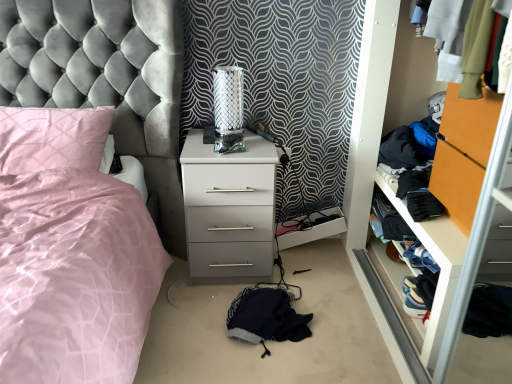
What are the coordinates of `white glossy chest of drawers at center` in the screenshot? It's located at (229, 210).

At what (x,y) coordinates should I click in order to perform the action: click on pink satin pillow at left. Please return your answer as a coordinate pair (x, y). The height and width of the screenshot is (384, 512). Looking at the image, I should click on (52, 138).

This screenshot has height=384, width=512. I want to click on satin pink bed at left, so click(106, 78).

Image resolution: width=512 pixels, height=384 pixels. What do you see at coordinates (106, 78) in the screenshot?
I see `satin pink bed at left` at bounding box center [106, 78].

This screenshot has width=512, height=384. In order to click on white glossy chest of drawers at center in this screenshot , I will do `click(229, 210)`.

From the image's perspective, does black fleece gloves at right, the 3th clothing ordered from the bottom, appear lower than denim fabric clothes at right?

No, from the image's perspective, black fleece gloves at right, the 3th clothing ordered from the bottom, is not beneath denim fabric clothes at right.

Is black fleece gloves at right, the 2th clothing positioned from the left, bigger or smaller than denim fabric clothes at right?

In the image, black fleece gloves at right, the 2th clothing positioned from the left, appears to be smaller than denim fabric clothes at right.

Is there a large distance between black fleece gloves at right, which is the first clothing from top to bottom, and denim fabric clothes at right?

Actually, black fleece gloves at right, which is the first clothing from top to bottom, and denim fabric clothes at right are a little close together.

Could denim fabric clothes at right be considered to be inside pink satin pillow at left?

No, denim fabric clothes at right is not surrounded by pink satin pillow at left.

Would you consider pink satin pillow at left to be distant from denim fabric clothes at right?

Yes.

Could you tell me if pink satin pillow at left is turned towards denim fabric clothes at right?

No, pink satin pillow at left is not turned towards denim fabric clothes at right.

Is pink satin pillow at left at the left side of denim fabric clothes at right?

Correct, you'll find pink satin pillow at left to the left of denim fabric clothes at right.

Is metallic mesh table lamp at center closer to the viewer compared to satin pink bed at left?

No, metallic mesh table lamp at center is further to the viewer.

How much distance is there between metallic mesh table lamp at center and satin pink bed at left?

metallic mesh table lamp at center and satin pink bed at left are 40.62 centimeters apart.

Which is in front, point (234, 73) or point (119, 146)?

The point (234, 73) is in front.

Could you tell me if metallic mesh table lamp at center is facing satin pink bed at left?

No, metallic mesh table lamp at center is not turned towards satin pink bed at left.

How distant is orange wood file cabinet at right from fuzzy dark blue blanket at lower center, the third clothing from the right?

They are 31.66 inches apart.

In the scene shown: Choose the correct answer: Is orange wood file cabinet at right inside fuzzy dark blue blanket at lower center, the first clothing when ordered from left to right, or outside it?

orange wood file cabinet at right lies outside fuzzy dark blue blanket at lower center, the first clothing when ordered from left to right.

From the image's perspective, who appears lower, orange wood file cabinet at right or fuzzy dark blue blanket at lower center, the third clothing from the right?

fuzzy dark blue blanket at lower center, the third clothing from the right, is shown below in the image.

Is orange wood file cabinet at right turned away from fuzzy dark blue blanket at lower center, the first clothing when ordered from left to right?

No, fuzzy dark blue blanket at lower center, the first clothing when ordered from left to right, is not at the back of orange wood file cabinet at right.

From the image's perspective, is orange wood file cabinet at right located above or below metallic mesh table lamp at center?

orange wood file cabinet at right is below metallic mesh table lamp at center.

Considering the relative sizes of orange wood file cabinet at right and metallic mesh table lamp at center in the image provided, is orange wood file cabinet at right taller than metallic mesh table lamp at center?

Indeed, orange wood file cabinet at right has a greater height compared to metallic mesh table lamp at center.

Is orange wood file cabinet at right at the right side of metallic mesh table lamp at center?

Indeed, orange wood file cabinet at right is positioned on the right side of metallic mesh table lamp at center.

Is orange wood file cabinet at right positioned in front of metallic mesh table lamp at center?

Yes, it is.

Is fuzzy dark blue blanket at lower center, the first clothing when ordered from left to right, turned away from denim fabric clothes at right?

That's not correct — fuzzy dark blue blanket at lower center, the first clothing when ordered from left to right, is not looking away from denim fabric clothes at right.

Which is more to the left, fuzzy dark blue blanket at lower center, the third clothing from the right, or denim fabric clothes at right?

Positioned to the left is fuzzy dark blue blanket at lower center, the third clothing from the right.

From a real-world perspective, is fuzzy dark blue blanket at lower center, the first clothing ordered from the bottom, positioned above or below denim fabric clothes at right?

From a real-world perspective, fuzzy dark blue blanket at lower center, the first clothing ordered from the bottom, is physically below denim fabric clothes at right.

Between fuzzy dark blue blanket at lower center, which is the 3th clothing from top to bottom, and denim fabric clothes at right, which one has smaller width?

Thinner between the two is denim fabric clothes at right.

Between black fleece gloves at right, the 3th clothing ordered from the bottom, and fuzzy dark blue blanket at lower center, the first clothing when ordered from left to right, which one is positioned in front?

fuzzy dark blue blanket at lower center, the first clothing when ordered from left to right, is more forward.

Are black fleece gloves at right, the 3th clothing ordered from the bottom, and fuzzy dark blue blanket at lower center, the first clothing ordered from the bottom, making contact?

No, black fleece gloves at right, the 3th clothing ordered from the bottom, is not in contact with fuzzy dark blue blanket at lower center, the first clothing ordered from the bottom.

Does point (383, 215) lie in front of point (253, 340)?

No.

Considering the sizes of objects black fleece gloves at right, the 2th clothing positioned from the left, and fuzzy dark blue blanket at lower center, which is the 3th clothing from top to bottom, in the image provided, who is taller, black fleece gloves at right, the 2th clothing positioned from the left, or fuzzy dark blue blanket at lower center, which is the 3th clothing from top to bottom,?

With more height is fuzzy dark blue blanket at lower center, which is the 3th clothing from top to bottom.

Locate an element on the screen. The image size is (512, 384). shelf that is under the black fleece gloves at right, the 2th clothing positioned from the left (from a real-world perspective) is located at coordinates pyautogui.click(x=438, y=264).

Identify the location of shelf on the right of pink satin pillow at left. (438, 264).

Estimate the real-world distances between objects in this image. Which object is further from metallic mesh table lamp at center, satin pink bed at left or pink satin pillow at left?

pink satin pillow at left lies further to metallic mesh table lamp at center than the other object.

Estimate the real-world distances between objects in this image. Which object is further from white glossy chest of drawers at center, denim jeans at lower right, the 2th clothing from the top, or orange wood file cabinet at right?

denim jeans at lower right, the 2th clothing from the top, lies further to white glossy chest of drawers at center than the other object.

Estimate the real-world distances between objects in this image. Which object is closer to satin pink bed at left, orange wood file cabinet at right or pink satin pillow at left?

pink satin pillow at left is closer to satin pink bed at left.

When comparing their distances from black fleece gloves at right, the 2th clothing positioned from the left, does denim jeans at lower right, marked as the second clothing in a bottom-to-top arrangement, or denim fabric clothes at right seem further?

Among the two, denim jeans at lower right, marked as the second clothing in a bottom-to-top arrangement, is located further to black fleece gloves at right, the 2th clothing positioned from the left.

Looking at the image, which one is located further to denim jeans at lower right, positioned as the third clothing in left-to-right order, black fleece gloves at right, the 3th clothing ordered from the bottom, or white glossy chest of drawers at center?

white glossy chest of drawers at center lies further to denim jeans at lower right, positioned as the third clothing in left-to-right order, than the other object.

Which object lies nearer to the anchor point metallic mesh table lamp at center, denim jeans at lower right, positioned as the third clothing in left-to-right order, or fuzzy dark blue blanket at lower center, the first clothing when ordered from left to right?

fuzzy dark blue blanket at lower center, the first clothing when ordered from left to right.

Estimate the real-world distances between objects in this image. Which object is further from black fleece gloves at right, which is the second clothing in right-to-left order, fuzzy dark blue blanket at lower center, the first clothing ordered from the bottom, or metallic mesh table lamp at center?

metallic mesh table lamp at center lies further to black fleece gloves at right, which is the second clothing in right-to-left order, than the other object.

Considering their positions, is black fleece gloves at right, which is the first clothing from top to bottom, positioned closer to denim fabric clothes at right than fuzzy dark blue blanket at lower center, the first clothing when ordered from left to right?

The object closer to denim fabric clothes at right is black fleece gloves at right, which is the first clothing from top to bottom.

Where is `shelf between metallic mesh table lamp at center and denim jeans at lower right, positioned as the third clothing in left-to-right order`? This screenshot has height=384, width=512. shelf between metallic mesh table lamp at center and denim jeans at lower right, positioned as the third clothing in left-to-right order is located at coordinates (438, 264).

This screenshot has height=384, width=512. I want to click on clothing between satin pink bed at left and denim jeans at lower right, marked as the second clothing in a bottom-to-top arrangement, along the z-axis, so click(266, 317).

Where is `shelf situated between metallic mesh table lamp at center and orange wood file cabinet at right from left to right`? This screenshot has width=512, height=384. shelf situated between metallic mesh table lamp at center and orange wood file cabinet at right from left to right is located at coordinates (438, 264).

Find the location of a particular element. This screenshot has width=512, height=384. shelf situated between white glossy chest of drawers at center and black fleece gloves at right, the 3th clothing ordered from the bottom, from left to right is located at coordinates (438, 264).